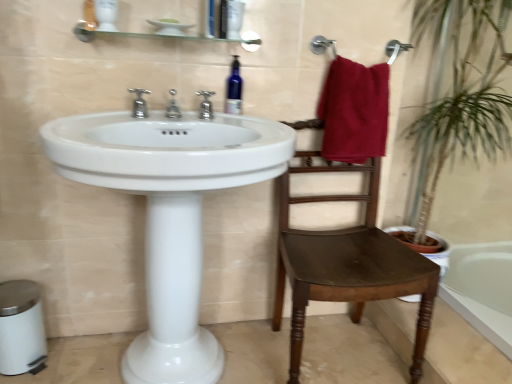
The height and width of the screenshot is (384, 512). I want to click on vacant area that lies to the right of polished chrome faucet at center, the 1th tap in the left-to-right sequence, so click(187, 120).